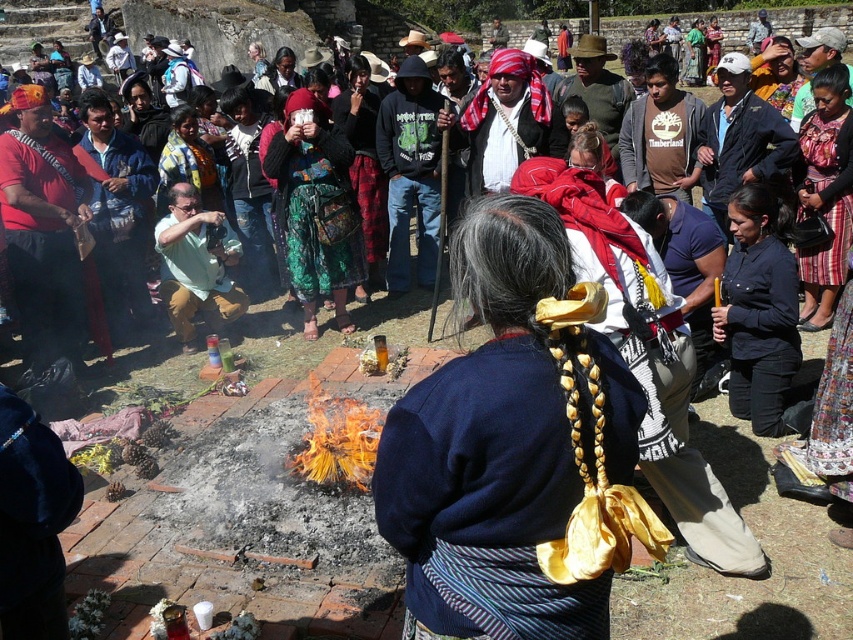
You are attending this event and need to decide which item to grab first. Since you can only reach items within arm length, and you know the dark blue sweater at center is shorter than the multicolored woven skirt at center, which one is easier to reach?

The dark blue sweater at center is easier to reach because it is shorter than the multicolored woven skirt at center, making it closer to your arm length.

You are a photographer at the event and want to capture both the multicolored woven skirt at center and the green matte shirt at center in the same frame. Based on their positions, which one is on the left side of the other?

The green matte shirt at center is on the left side of the multicolored woven skirt at center because the multicolored woven skirt at center is to the right of green matte shirt at center.